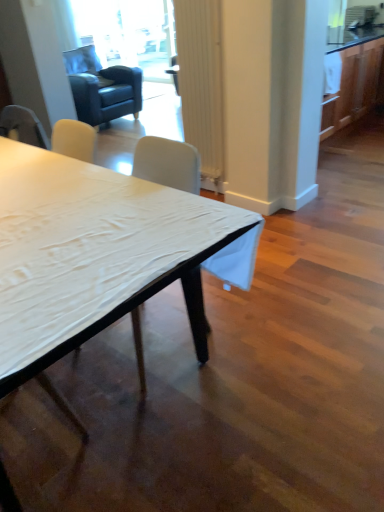
I want to click on free space in front of white fabric chair at center, so click(159, 422).